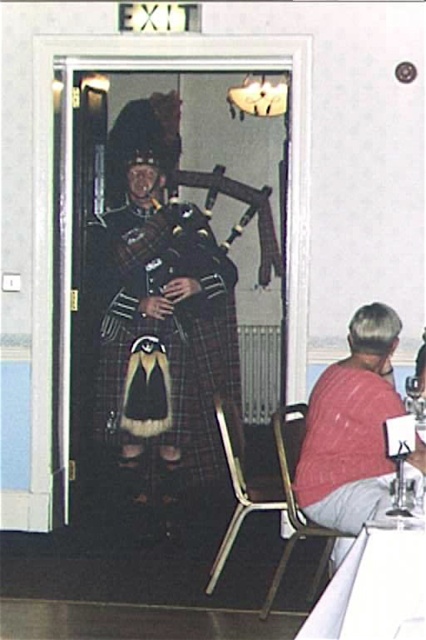
You are a tour guide leading a group through the dining area. You need to move from the metallic gold chair at lower center to the polished wood bagpipes at center. Can you walk directly between them without needing to detour around any obstacles?

The distance between the metallic gold chair at lower center and the polished wood bagpipes at center is 3.62 meters, so yes, you can walk directly between them without needing to detour around any obstacles since there is enough space.

You are standing at the point labeled point (354, 532) and want to walk to the point labeled point (215, 568). Which direction should you move to get closer to your destination?

You should move backward because point (354, 532) is in front of point (215, 568), so moving backward will bring you closer to the destination.